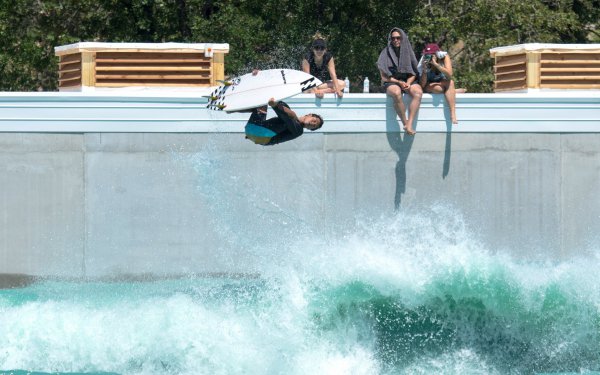
The height and width of the screenshot is (375, 600). I want to click on white border on top of wall, so click(x=516, y=116).